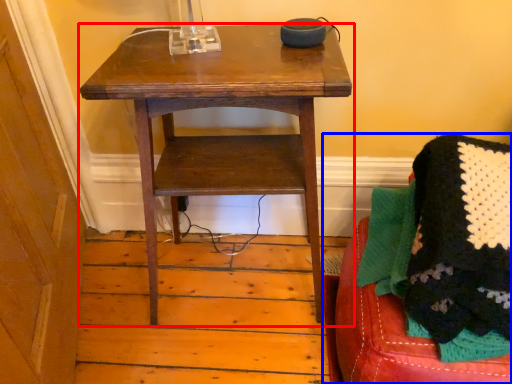
Question: Which of the following is the farthest to the observer, table (highlighted by a red box) or furniture (highlighted by a blue box)?

Choices:
 (A) table
 (B) furniture

Answer: (A)